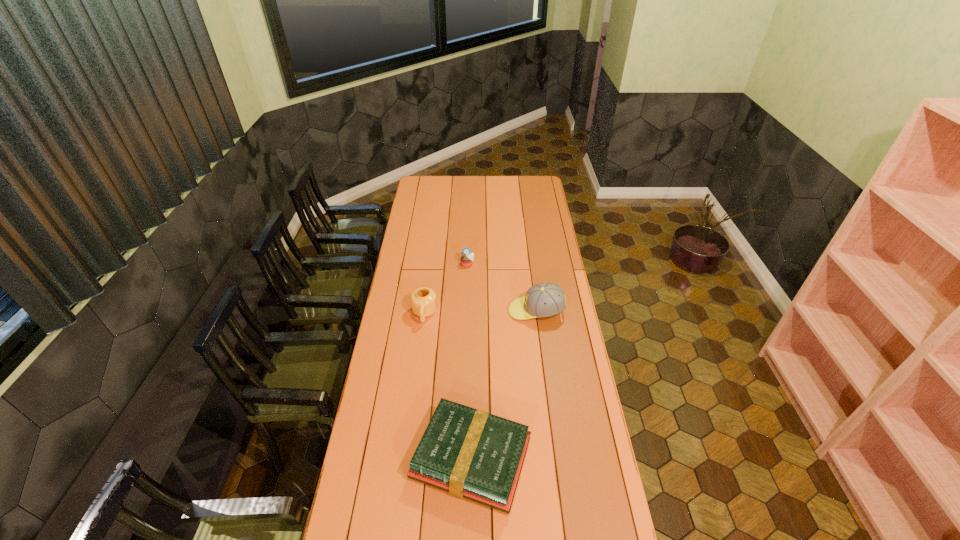
Image resolution: width=960 pixels, height=540 pixels. Find the location of `free point that satisfies the following two spatial constraints: 1. on the front-facing side of the baseball cap; 2. on the handle side of the mug`. free point that satisfies the following two spatial constraints: 1. on the front-facing side of the baseball cap; 2. on the handle side of the mug is located at coordinates (537, 314).

What are the coordinates of `vacant space that satisfies the following two spatial constraints: 1. on the handle side of the mug; 2. on the right side of the nearest object` in the screenshot? It's located at (406, 458).

This screenshot has height=540, width=960. I want to click on free spot that satisfies the following two spatial constraints: 1. on the front-facing side of the muffin; 2. on the left side of the hardback book, so click(x=462, y=458).

The height and width of the screenshot is (540, 960). Find the location of `vacant space that satisfies the following two spatial constraints: 1. on the handle side of the hardback book; 2. on the left side of the mug`. vacant space that satisfies the following two spatial constraints: 1. on the handle side of the hardback book; 2. on the left side of the mug is located at coordinates (406, 458).